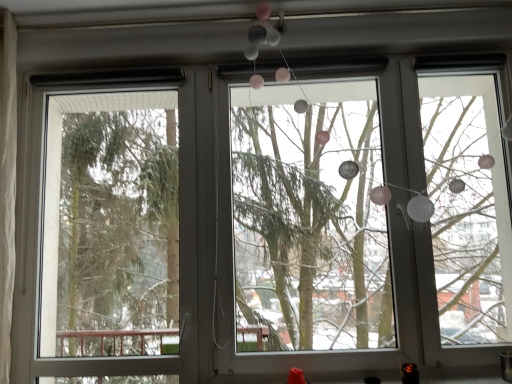
Question: Considering the relative sizes of transparent glass screen door at left and matte white garland at center in the image provided, is transparent glass screen door at left thinner than matte white garland at center?

Choices:
 (A) no
 (B) yes

Answer: (B)

Question: Is transparent glass screen door at left further to camera compared to matte white garland at center?

Choices:
 (A) no
 (B) yes

Answer: (B)

Question: From the image's perspective, is transparent glass screen door at left located beneath matte white garland at center?

Choices:
 (A) yes
 (B) no

Answer: (A)

Question: Is transparent glass screen door at left not close to matte white garland at center?

Choices:
 (A) yes
 (B) no

Answer: (A)

Question: From a real-world perspective, is transparent glass screen door at left located higher than matte white garland at center?

Choices:
 (A) yes
 (B) no

Answer: (B)

Question: Does transparent glass screen door at left appear on the left side of matte white garland at center?

Choices:
 (A) yes
 (B) no

Answer: (A)

Question: Is matte white garland at center to the right of transparent glass screen door at left from the viewer's perspective?

Choices:
 (A) no
 (B) yes

Answer: (B)

Question: Is matte white garland at center in front of transparent glass screen door at left?

Choices:
 (A) yes
 (B) no

Answer: (A)

Question: Does matte white garland at center have a greater height compared to transparent glass screen door at left?

Choices:
 (A) no
 (B) yes

Answer: (B)

Question: From a real-world perspective, does matte white garland at center stand above transparent glass screen door at left?

Choices:
 (A) no
 (B) yes

Answer: (B)

Question: Considering the relative sizes of matte white garland at center and transparent glass screen door at left in the image provided, is matte white garland at center wider than transparent glass screen door at left?

Choices:
 (A) yes
 (B) no

Answer: (A)

Question: Considering the relative sizes of matte white garland at center and transparent glass screen door at left in the image provided, is matte white garland at center thinner than transparent glass screen door at left?

Choices:
 (A) yes
 (B) no

Answer: (B)

Question: From a real-world perspective, is matte white garland at center above or below transparent glass screen door at left?

Choices:
 (A) below
 (B) above

Answer: (B)